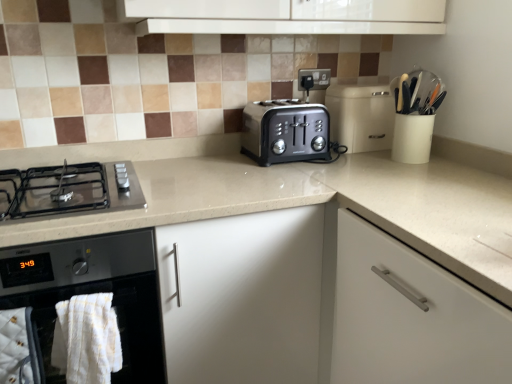
Question: Does beige plastic bread bin at center have a lesser height compared to black matte gas stove at lower left?

Choices:
 (A) no
 (B) yes

Answer: (A)

Question: Is the depth of beige plastic bread bin at center greater than that of black matte gas stove at lower left?

Choices:
 (A) no
 (B) yes

Answer: (B)

Question: Is beige plastic bread bin at center completely or partially outside of black matte gas stove at lower left?

Choices:
 (A) yes
 (B) no

Answer: (A)

Question: Is beige plastic bread bin at center to the left of black matte gas stove at lower left from the viewer's perspective?

Choices:
 (A) no
 (B) yes

Answer: (A)

Question: From the image's perspective, is beige plastic bread bin at center located above black matte gas stove at lower left?

Choices:
 (A) no
 (B) yes

Answer: (B)

Question: Is point (451, 266) positioned closer to the camera than point (326, 99)?

Choices:
 (A) closer
 (B) farther

Answer: (A)

Question: From the image's perspective, is beige glossy countertop at center above or below beige plastic bread bin at center?

Choices:
 (A) below
 (B) above

Answer: (A)

Question: From a real-world perspective, is beige glossy countertop at center positioned above or below beige plastic bread bin at center?

Choices:
 (A) below
 (B) above

Answer: (A)

Question: Visually, is beige glossy countertop at center positioned to the left or to the right of beige plastic bread bin at center?

Choices:
 (A) right
 (B) left

Answer: (B)

Question: Is black glass oven at lower left taller or shorter than satin black toaster at center?

Choices:
 (A) tall
 (B) short

Answer: (A)

Question: Relative to satin black toaster at center, is black glass oven at lower left in front or behind?

Choices:
 (A) front
 (B) behind

Answer: (A)

Question: Is black glass oven at lower left to the left or to the right of satin black toaster at center in the image?

Choices:
 (A) right
 (B) left

Answer: (B)

Question: In terms of size, does black glass oven at lower left appear bigger or smaller than satin black toaster at center?

Choices:
 (A) big
 (B) small

Answer: (A)

Question: From a real-world perspective, is beige plastic bread bin at center physically located above or below satin black toaster at center?

Choices:
 (A) above
 (B) below

Answer: (A)

Question: Considering the relative positions of beige plastic bread bin at center and satin black toaster at center in the image provided, is beige plastic bread bin at center to the left or to the right of satin black toaster at center?

Choices:
 (A) left
 (B) right

Answer: (B)